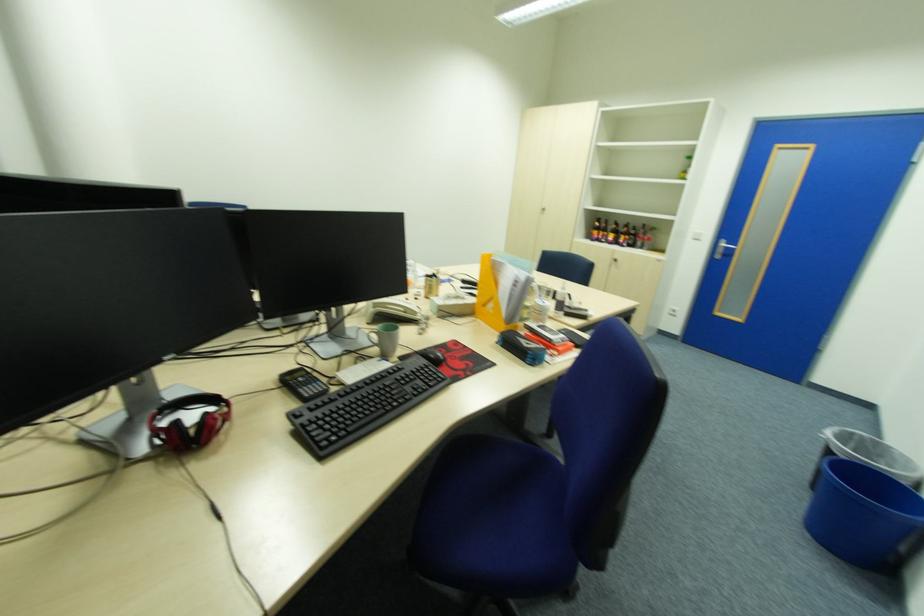
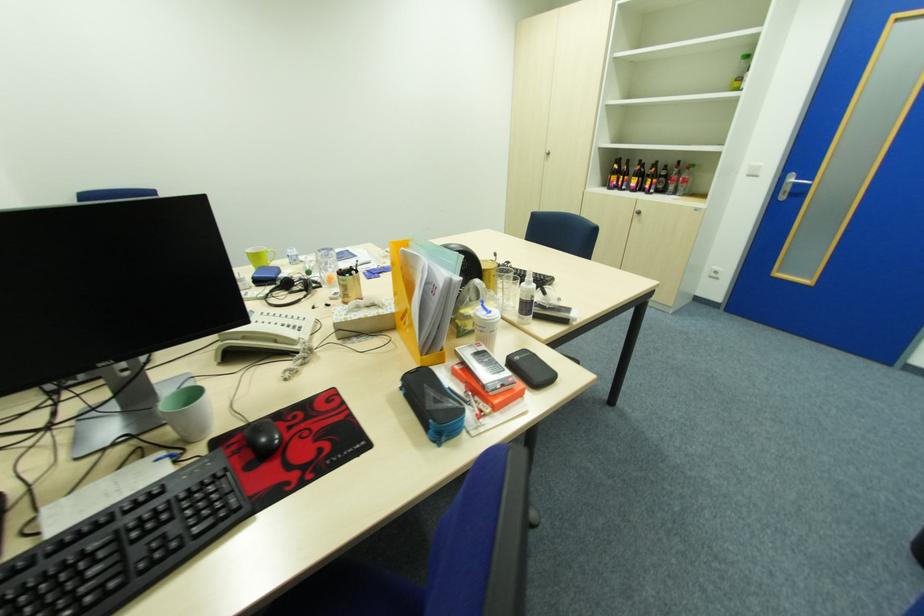
Question: The images are taken continuously from a first-person perspective. In which direction is your viewpoint rotating?

Choices:
 (A) Left
 (B) Right
 (C) Up
 (D) Down

Answer: (D)